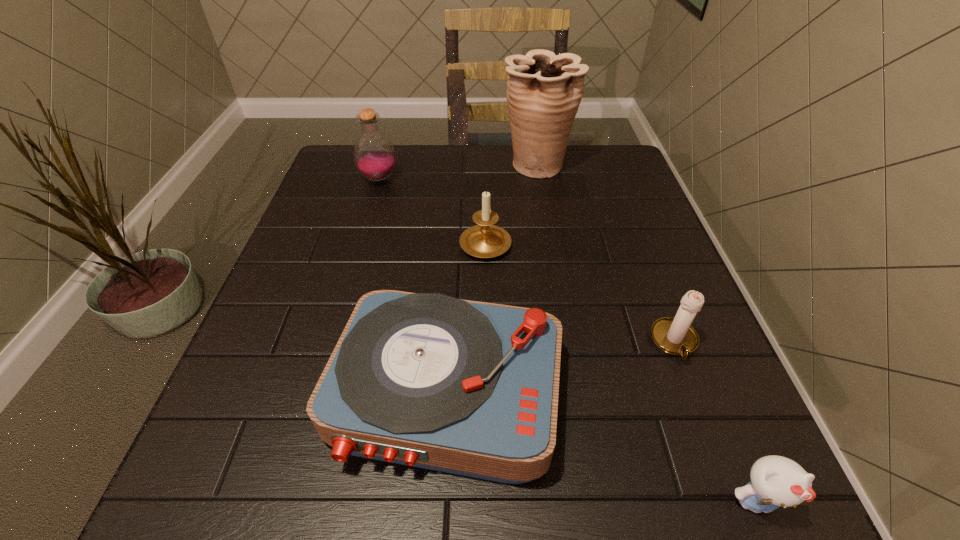
Locate an element on the screen. The width and height of the screenshot is (960, 540). candle holder that is at the right edge is located at coordinates (676, 336).

At what (x,y) coordinates should I click in order to perform the action: click on kitten situated at the right edge. Please return your answer as a coordinate pair (x, y). Image resolution: width=960 pixels, height=540 pixels. Looking at the image, I should click on (776, 481).

Where is `object that is at the far left corner`? The height and width of the screenshot is (540, 960). object that is at the far left corner is located at coordinates (374, 155).

This screenshot has height=540, width=960. Find the location of `object present at the far right corner`. object present at the far right corner is located at coordinates (544, 91).

Identify the location of object situated at the near right corner. point(776,481).

The image size is (960, 540). I want to click on free space at the far edge, so click(x=461, y=172).

Where is `vacant space at the near edge of the desktop`? vacant space at the near edge of the desktop is located at coordinates (358, 488).

Find the location of `free location at the left edge`. free location at the left edge is located at coordinates (328, 225).

Locate an element on the screen. The image size is (960, 540). free space at the right edge of the desktop is located at coordinates (667, 358).

In order to click on free space at the far left corner in this screenshot , I will do `click(345, 173)`.